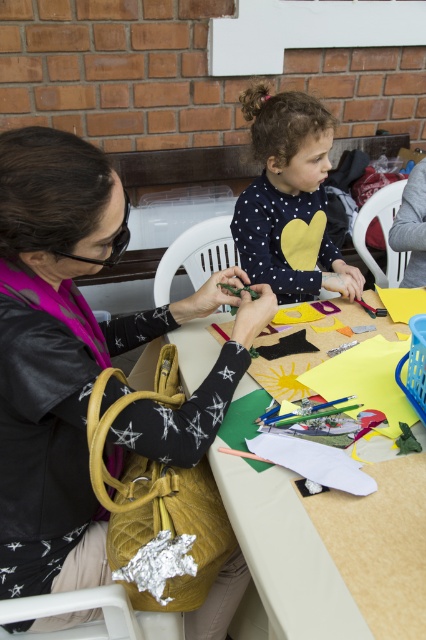
You are organizing a craft fair and need to place a sign on the table. The sign must be placed to the right of the quilted yellow purse at center. Will the sign be on the same table as the matte brown table at center?

Yes, the sign will be on the same matte brown table at center because the quilted yellow purse at center is already positioned to the left of the matte brown table at center, so placing the sign to the right of the purse would still be on the table.

You are organizing a craft fair and need to place a quilted yellow purse at center and a matte brown table at center. Given that they must be at least 10 inches apart for safety, will their current spacing meet the requirement?

The quilted yellow purse at center and matte brown table at center are 9.80 inches apart, which is less than the required 10 inches. Therefore, they do not meet the safety requirement and need to be moved further apart.

You are standing in front of the matte brown table at center and want to place a 12 inch ruler on it. Can you reach the table without moving your position?

The distance between you and the matte brown table at center is 24.46 inches. Since the ruler is only 12 inches long, you can comfortably reach the table to place it without needing to move.